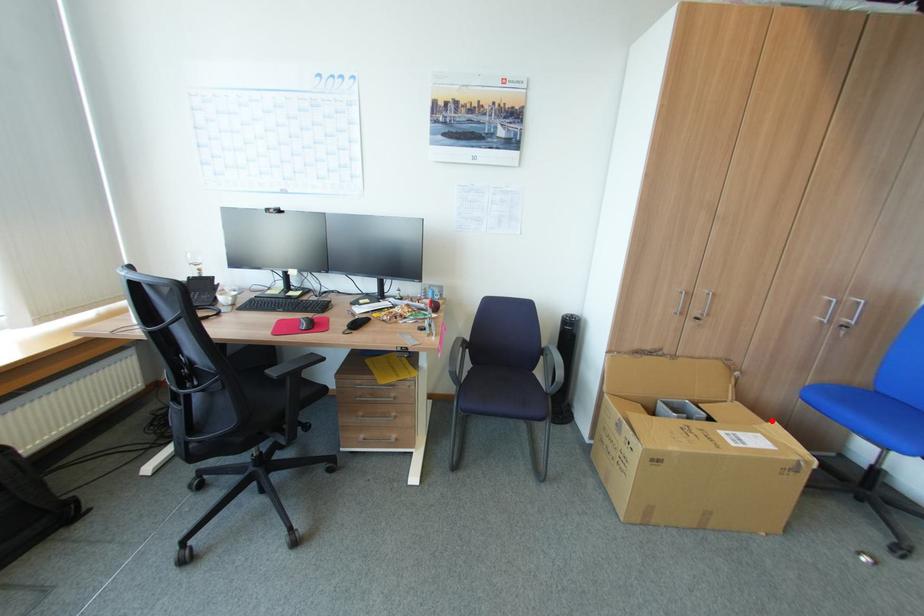
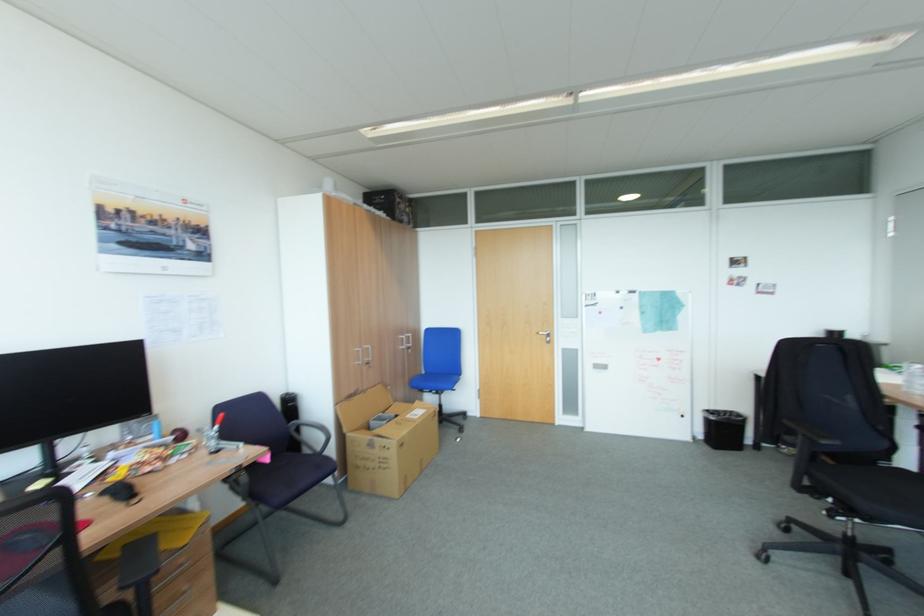
The point at the highlighted location is marked in the first image. Where is the corresponding point in the second image?

(419, 403)